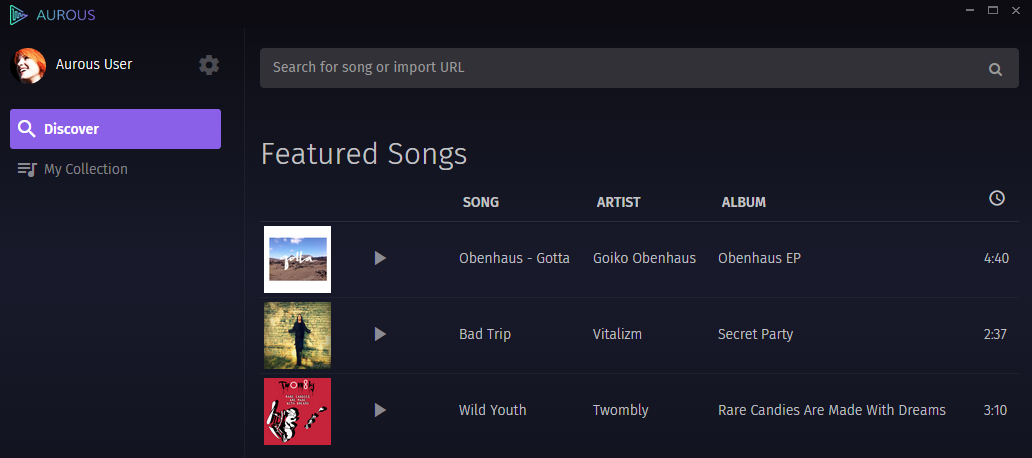
Find the location of a particular element. Image resolution: width=1032 pixels, height=458 pixels. grey dividers is located at coordinates (241, 112), (379, 221), (410, 294), (414, 370).